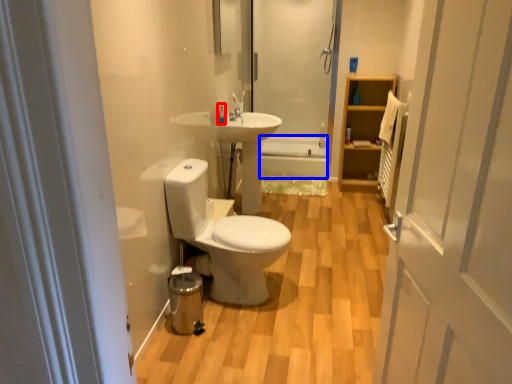
Question: Which point is closer to the camera, toiletry (highlighted by a red box) or bath (highlighted by a blue box)?

Choices:
 (A) toiletry
 (B) bath

Answer: (A)